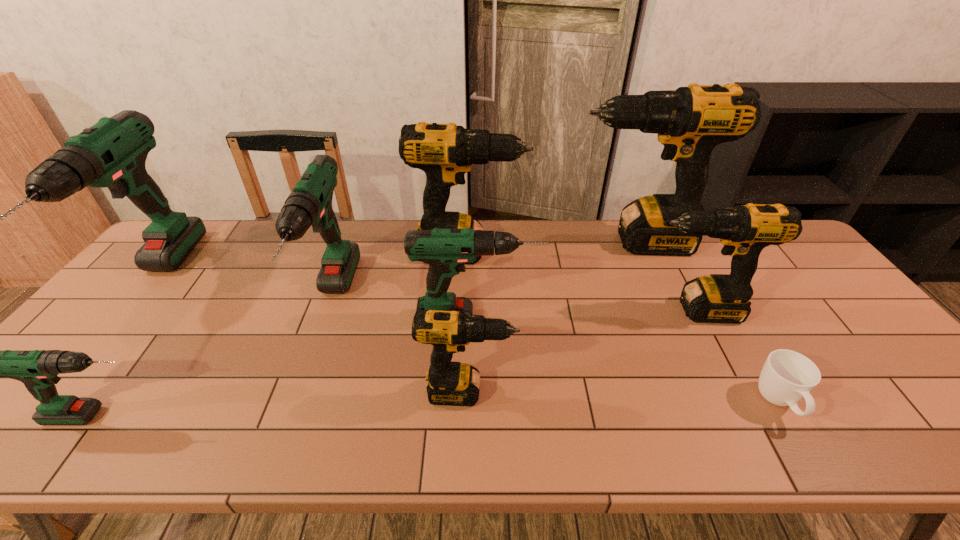
The height and width of the screenshot is (540, 960). In order to click on the biggest black drill in this screenshot , I will do `click(691, 121)`.

Where is `the biggest green drill`? The image size is (960, 540). the biggest green drill is located at coordinates (112, 153).

Identify the location of the second biggest black drill. (445, 152).

Locate an element on the screen. The height and width of the screenshot is (540, 960). the second biggest green drill is located at coordinates (310, 203).

Where is `the seventh object from right to left`? the seventh object from right to left is located at coordinates (310, 203).

Identify the location of the second nearest black drill. The width and height of the screenshot is (960, 540). (744, 230).

Locate an element on the screen. the rightmost green drill is located at coordinates (446, 251).

Where is `the nearest black drill`? This screenshot has width=960, height=540. the nearest black drill is located at coordinates (x=450, y=383).

The image size is (960, 540). In order to click on the smallest green drill in this screenshot , I will do `click(37, 369)`.

Locate an element on the screen. the nearest green drill is located at coordinates [37, 369].